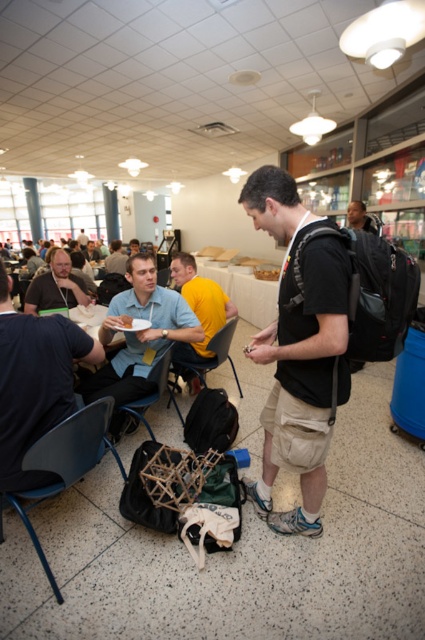
Question: Among these objects, which one is nearest to the camera?

Choices:
 (A) yellow t-shirt at center
 (B) metallic gray chair at lower center

Answer: (B)

Question: Does yellow t-shirt at center have a lesser width compared to blue plastic chair at center?

Choices:
 (A) no
 (B) yes

Answer: (B)

Question: Can you confirm if matte black shirt at left is positioned above matte black shirt at center?

Choices:
 (A) yes
 (B) no

Answer: (B)

Question: Is metallic gray chair at lower center below matte black shirt at center?

Choices:
 (A) no
 (B) yes

Answer: (B)

Question: Estimate the real-world distances between objects in this image. Which object is closer to the matte blue shirt at center?

Choices:
 (A) matte black shirt at left
 (B) metallic gray chair at lower center
 (C) dark gray shirt at left
 (D) blue plastic chair at lower left

Answer: (B)

Question: Among these objects, which one is nearest to the camera?

Choices:
 (A) blue plastic chair at center
 (B) dark gray shirt at left
 (C) matte black shirt at center
 (D) matte blue shirt at center

Answer: (B)